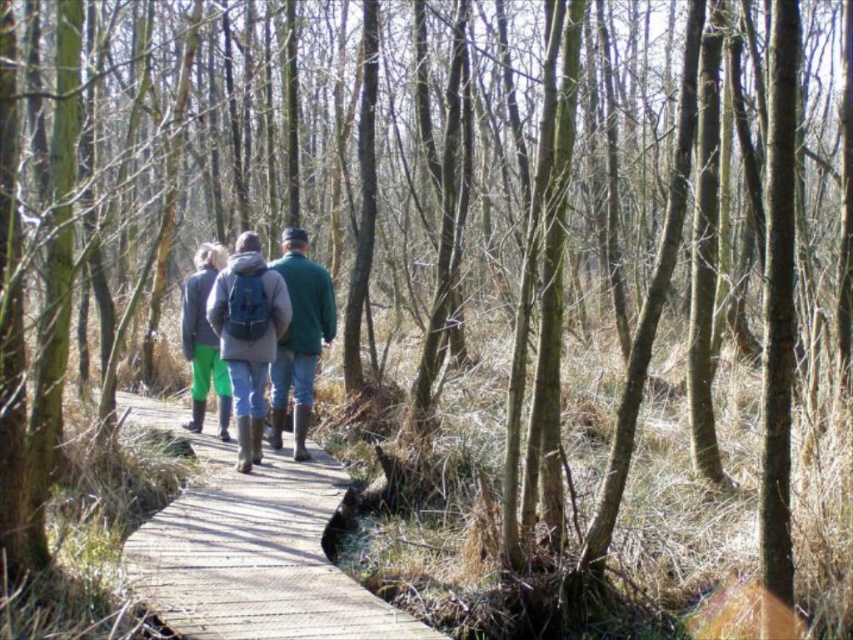
You are a hiker trying to cross the wooden boardwalk in the forest. You notice the wooden at center and the green rubber boots at center. Which object is taller?

The green rubber boots at center are taller than the wooden at center.

From the picture: You are planning to take a photo of the wooden at center and the green fabric jacket at center. Which object should you focus on first if you want to capture both in the same frame without moving the camera?

The wooden at center is smaller than the green fabric jacket at center, so you should focus on the green fabric jacket at center first to ensure it fits within the frame.